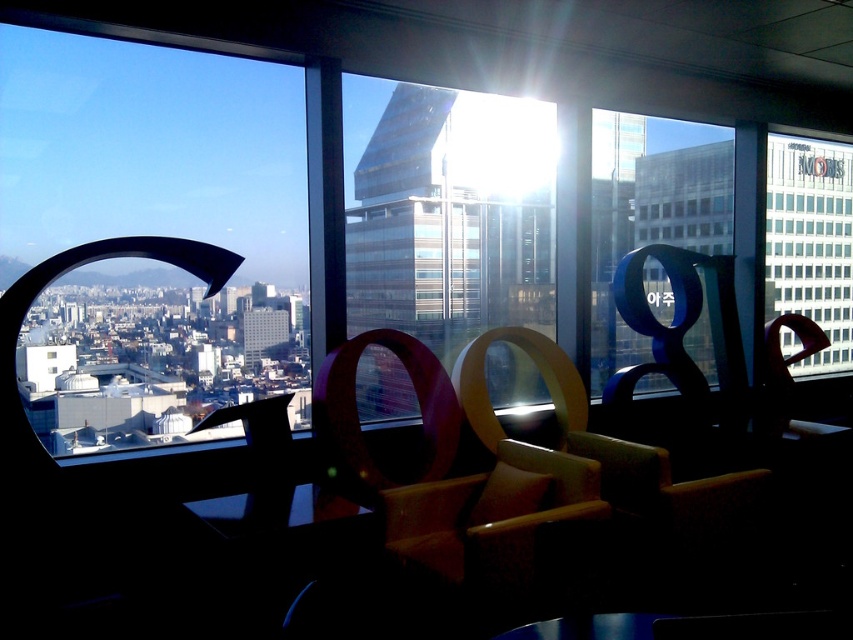
Is transparent glass window at upper left further to the viewer compared to transparent glass building at center?

That is False.

Can you confirm if transparent glass window at upper left is shorter than transparent glass building at center?

Incorrect, transparent glass window at upper left's height does not fall short of transparent glass building at center's.

Is point (45, 125) farther from viewer compared to point (405, 193)?

That is True.

This screenshot has height=640, width=853. Identify the location of transparent glass window at upper left. (144, 228).

Between transparent glass building at center and transparent glass window at upper right, which one has more height?

With more height is transparent glass building at center.

Does transparent glass building at center come behind transparent glass window at upper right?

No, transparent glass building at center is closer to the viewer.

Does point (517, 211) come in front of point (782, 344)?

Yes.

Find the location of a particular element. The width and height of the screenshot is (853, 640). transparent glass building at center is located at coordinates (451, 218).

Is transparent glass window at upper left behind transparent glass window at upper right?

That is False.

Does transparent glass window at upper left have a larger size compared to transparent glass window at upper right?

Yes.

Does point (109, 298) come behind point (808, 275)?

Yes, it is.

Locate an element on the screen. transparent glass window at upper left is located at coordinates (144, 228).